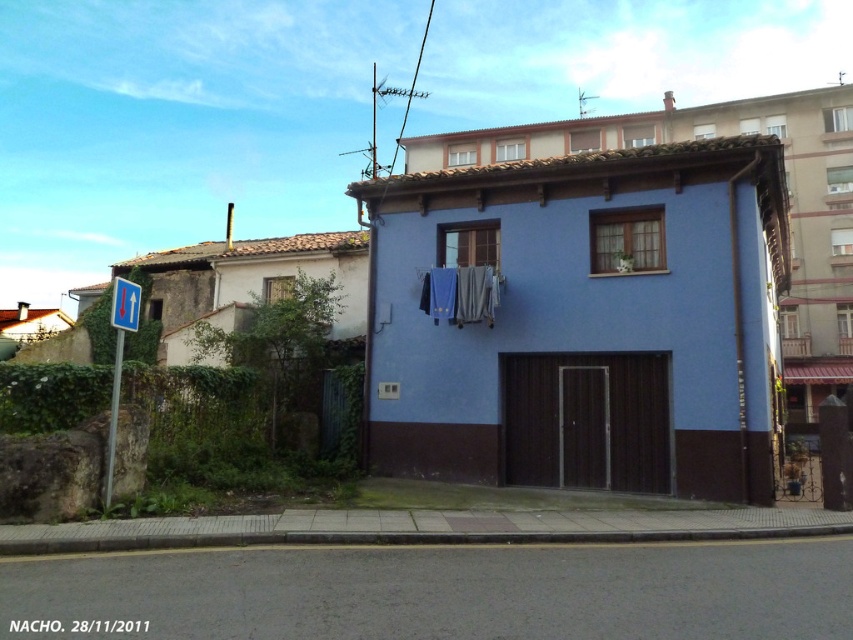
Who is positioned more to the right, blue fabric laundry at center or blue plastic sign at left?

blue fabric laundry at center is more to the right.

Can you confirm if blue fabric laundry at center is bigger than blue plastic sign at left?

Incorrect, blue fabric laundry at center is not larger than blue plastic sign at left.

Is point (463, 307) closer to viewer compared to point (125, 314)?

No, (463, 307) is further to viewer.

At what (x,y) coordinates should I click in order to perform the action: click on blue fabric laundry at center. Please return your answer as a coordinate pair (x, y). Looking at the image, I should click on (460, 294).